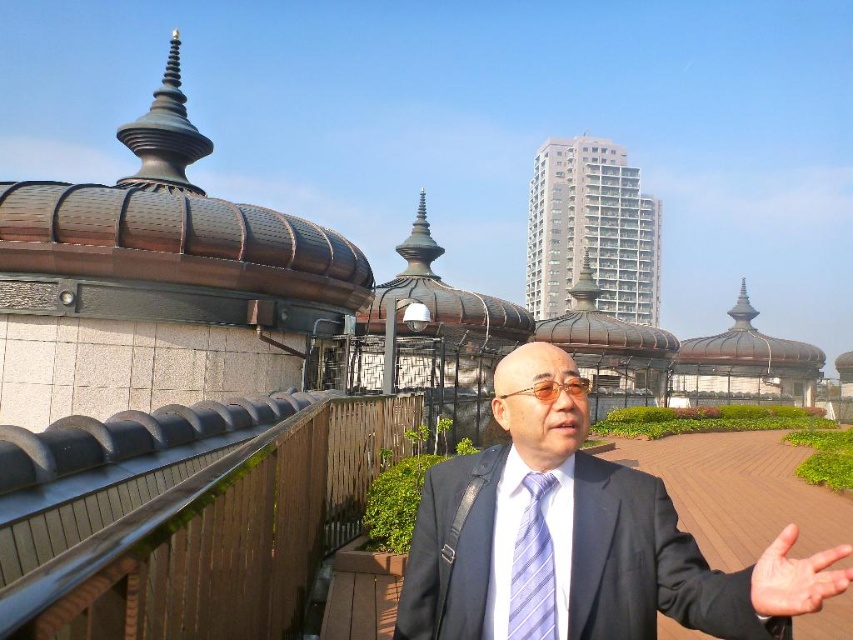
Based on the photo, does matte black suit at center appear under light blue striped tie at center?

Incorrect, matte black suit at center is not positioned below light blue striped tie at center.

Is matte black suit at center positioned before light blue striped tie at center?

Yes, matte black suit at center is in front of light blue striped tie at center.

Who is more distant from viewer, [512,472] or [543,531]?

The point [512,472] is more distant.

Where is `matte black suit at center`? The height and width of the screenshot is (640, 853). matte black suit at center is located at coordinates tap(560, 531).

This screenshot has height=640, width=853. Describe the element at coordinates (532, 566) in the screenshot. I see `light blue striped tie at center` at that location.

Does point (535, 611) come in front of point (750, 595)?

No, (535, 611) is further to viewer.

You are a GUI agent. You are given a task and a screenshot of the screen. Output one action in this format:
    pyautogui.click(x=<x>, y=<y>)
    Task: Click on the light blue striped tie at center
    The width and height of the screenshot is (853, 640).
    Given the screenshot: What is the action you would take?
    pyautogui.click(x=532, y=566)

Is the position of matte black suit at center less distant than that of light skin hand at center?

No, it is not.

At what (x,y) coordinates should I click in order to perform the action: click on matte black suit at center. Please return your answer as a coordinate pair (x, y). Looking at the image, I should click on (560, 531).

Between point (635, 588) and point (767, 552), which one is positioned in front?

Point (767, 552) is more forward.

At what (x,y) coordinates should I click in order to perform the action: click on matte black suit at center. Please return your answer as a coordinate pair (x, y). Looking at the image, I should click on (560, 531).